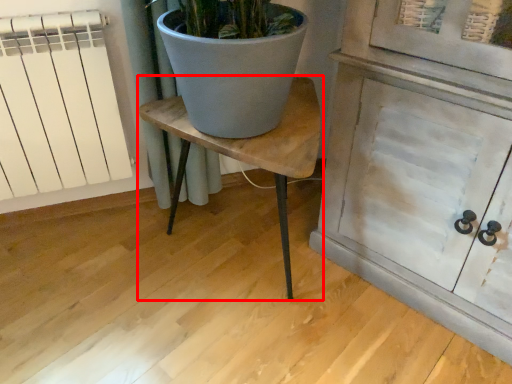
Question: From the image, what is the correct spatial relationship of table (annotated by the red box) in relation to radiator?

Choices:
 (A) left
 (B) right

Answer: (B)